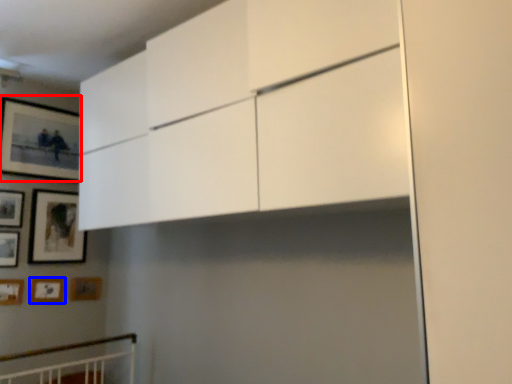
Question: Which object is further to the camera taking this photo, picture frame (highlighted by a red box) or picture frame (highlighted by a blue box)?

Choices:
 (A) picture frame
 (B) picture frame

Answer: (B)